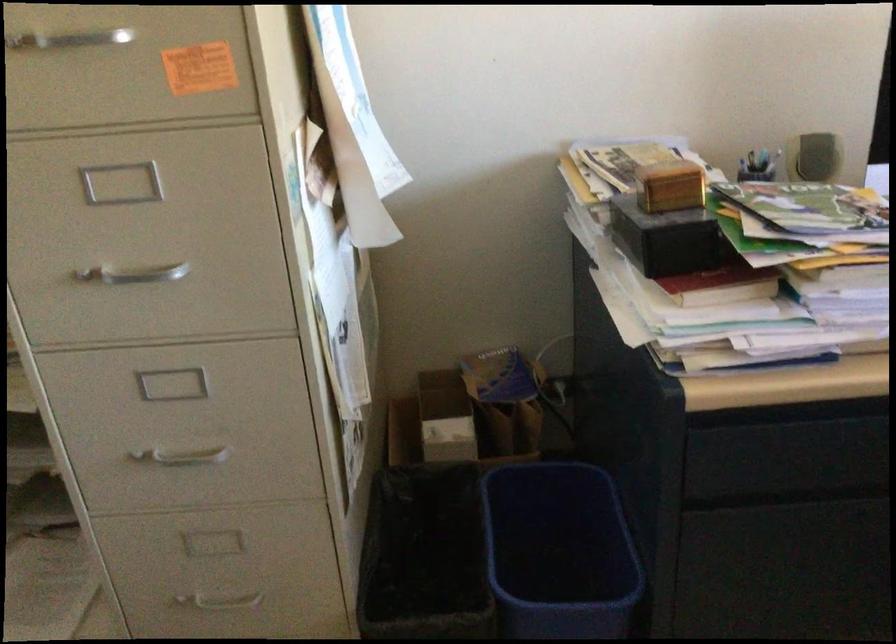
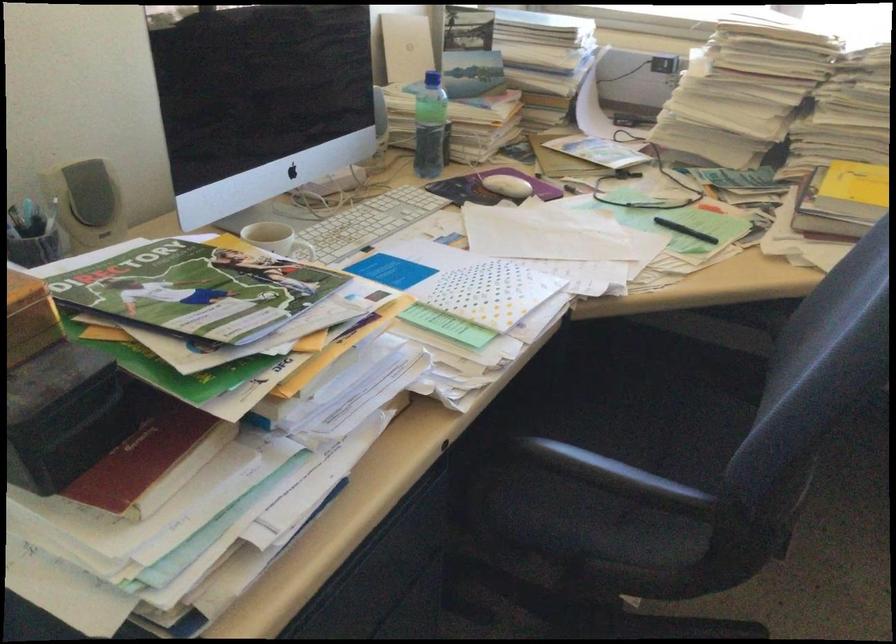
Find the pixel in the second image that matches pixel 803 207 in the first image.

(195, 290)